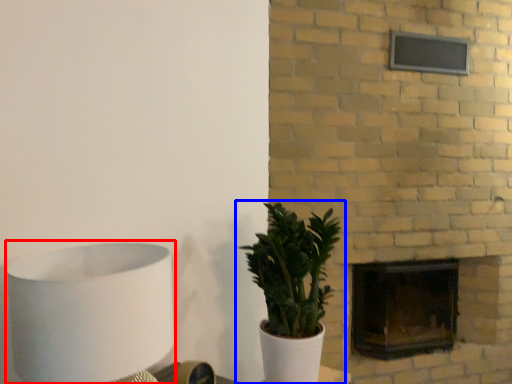
Question: Among these objects, which one is nearest to the camera, table lamp (highlighted by a red box) or houseplant (highlighted by a blue box)?

Choices:
 (A) table lamp
 (B) houseplant

Answer: (A)